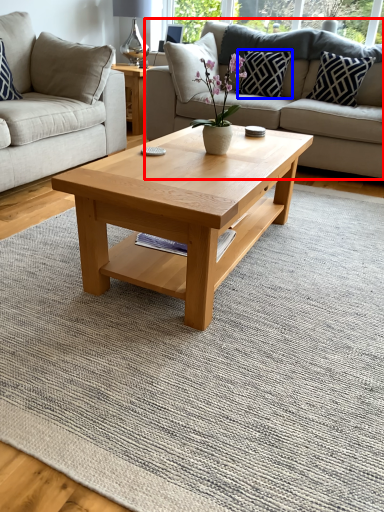
Question: Which point is closer to the camera, studio couch (highlighted by a red box) or pillow (highlighted by a blue box)?

Choices:
 (A) studio couch
 (B) pillow

Answer: (A)